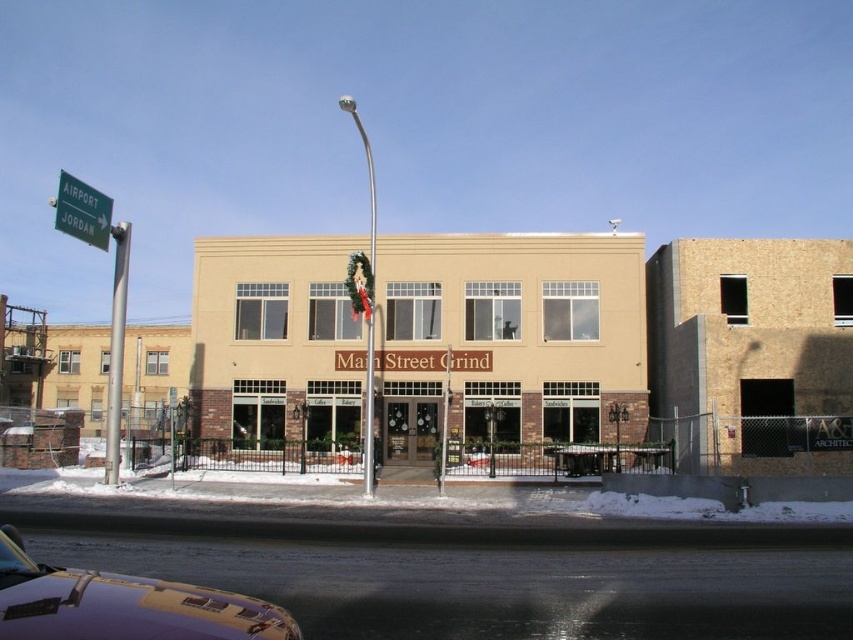
Question: Can you confirm if metallic purple car at lower left is positioned to the right of green metal sign at upper left?

Choices:
 (A) yes
 (B) no

Answer: (A)

Question: Which object appears closest to the camera in this image?

Choices:
 (A) green metal sign at upper left
 (B) metallic purple car at lower left
 (C) white powdery snow at lower center
 (D) silver metallic pole at left

Answer: (B)

Question: Can you confirm if white powdery snow at lower center is positioned to the left of silver metallic pole at left?

Choices:
 (A) no
 (B) yes

Answer: (A)

Question: Does metallic purple car at lower left have a smaller size compared to silver metallic pole at left?

Choices:
 (A) no
 (B) yes

Answer: (B)

Question: Estimate the real-world distances between objects in this image. Which object is closer to the metallic purple car at lower left?

Choices:
 (A) white powdery snow at lower center
 (B) green metal sign at upper left
 (C) silver metallic pole at left

Answer: (A)

Question: Which point is farther to the camera?

Choices:
 (A) green metal sign at upper left
 (B) white powdery snow at lower center
 (C) silver metallic pole at left

Answer: (C)